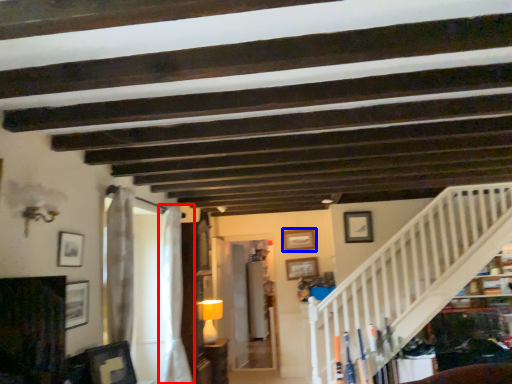
Question: Among these objects, which one is nearest to the camera, curtain (highlighted by a red box) or picture frame (highlighted by a blue box)?

Choices:
 (A) curtain
 (B) picture frame

Answer: (A)